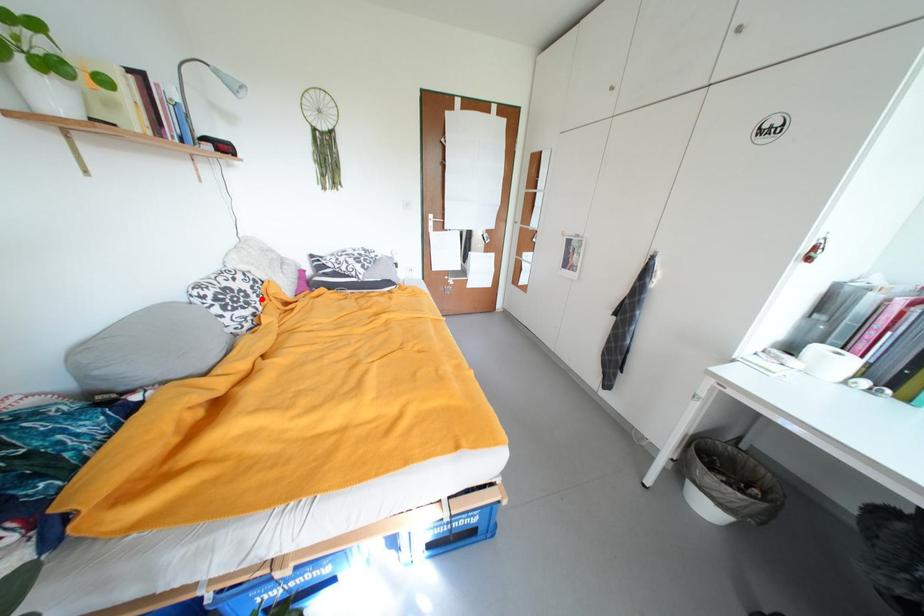
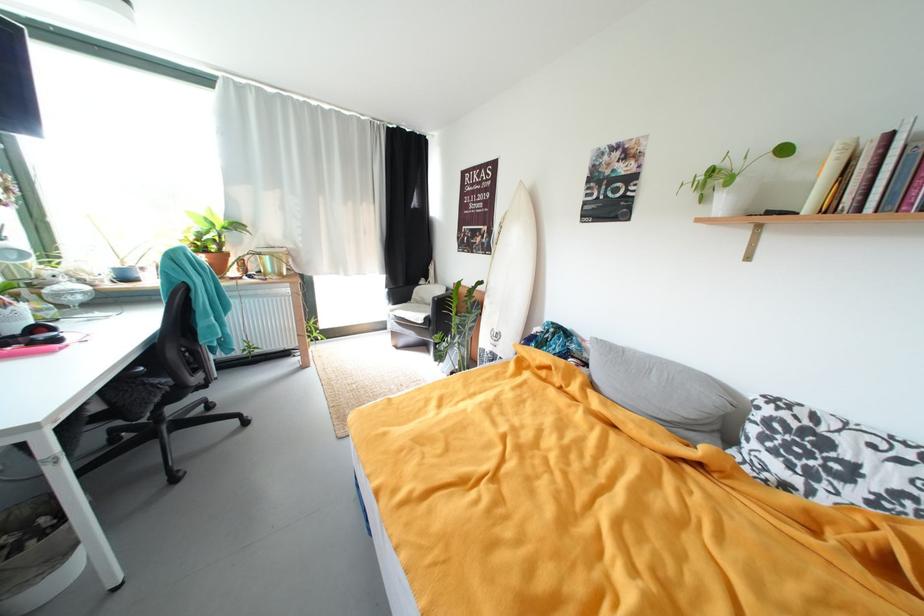
In the second image, find the point that corresponds to the highlighted location in the first image.

(861, 493)